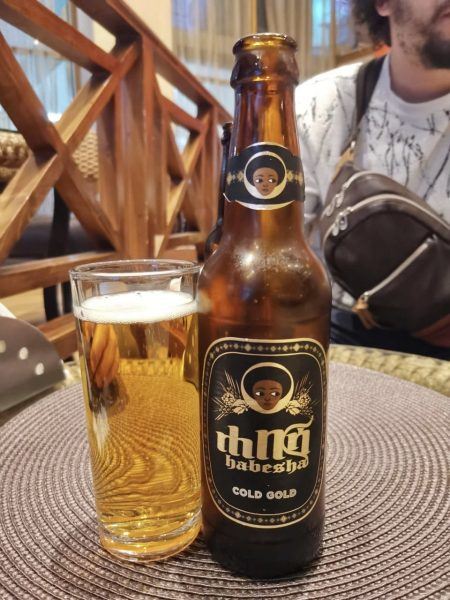
Where is `glass`? The image size is (450, 600). glass is located at coordinates (120, 387).